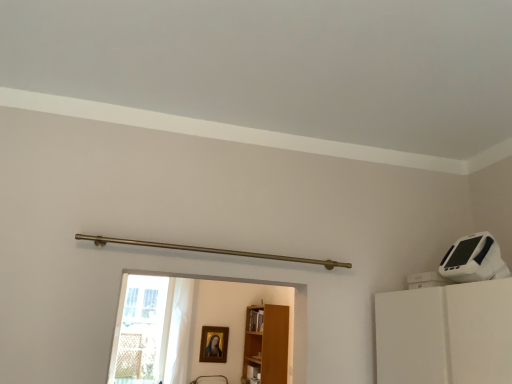
Question: Is gold-framed portrait at center in front of light brown wood bookshelf at center?

Choices:
 (A) no
 (B) yes

Answer: (A)

Question: Could you tell me if gold-framed portrait at center is facing light brown wood bookshelf at center?

Choices:
 (A) yes
 (B) no

Answer: (B)

Question: Is light brown wood bookshelf at center at the back of gold-framed portrait at center?

Choices:
 (A) yes
 (B) no

Answer: (B)

Question: From the image's perspective, is gold-framed portrait at center over light brown wood bookshelf at center?

Choices:
 (A) no
 (B) yes

Answer: (A)

Question: Is gold-framed portrait at center located outside light brown wood bookshelf at center?

Choices:
 (A) yes
 (B) no

Answer: (A)

Question: Does gold-framed portrait at center lie behind light brown wood bookshelf at center?

Choices:
 (A) no
 (B) yes

Answer: (B)

Question: Can you confirm if light brown wood bookshelf at center is wider than gold-framed portrait at center?

Choices:
 (A) no
 (B) yes

Answer: (B)

Question: Is light brown wood bookshelf at center further to camera compared to gold-framed portrait at center?

Choices:
 (A) yes
 (B) no

Answer: (B)

Question: From a real-world perspective, is light brown wood bookshelf at center positioned under gold-framed portrait at center based on gravity?

Choices:
 (A) yes
 (B) no

Answer: (B)

Question: Is light brown wood bookshelf at center in front of gold-framed portrait at center?

Choices:
 (A) yes
 (B) no

Answer: (A)

Question: Is light brown wood bookshelf at center shorter than gold-framed portrait at center?

Choices:
 (A) yes
 (B) no

Answer: (B)

Question: Does light brown wood bookshelf at center contain gold-framed portrait at center?

Choices:
 (A) no
 (B) yes

Answer: (A)

Question: From a real-world perspective, is transparent glass door at lower left positioned over gold-framed portrait at center based on gravity?

Choices:
 (A) no
 (B) yes

Answer: (B)